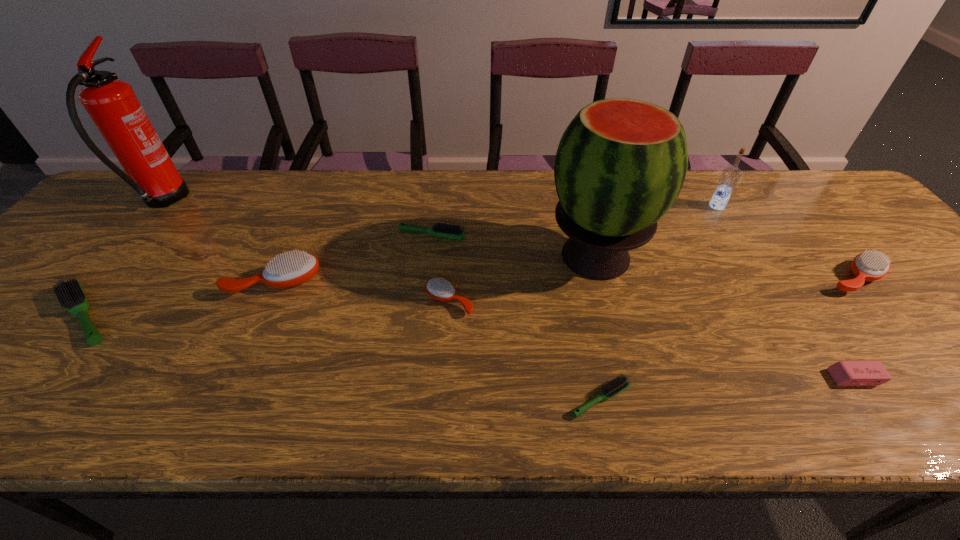
In order to click on hairbrush that can be found as the closest to the second smallest orange hairbrush in this screenshot , I will do `click(621, 383)`.

In order to click on the second closest orange hairbrush relative to the leftmost light hairbrush in this screenshot , I will do `click(440, 289)`.

Identify which orange hairbrush is the closest to the second orange hairbrush from right to left. Please provide its 2D coordinates. Your answer should be formatted as a tuple, i.e. [(x, y)], where the tuple contains the x and y coordinates of a point satisfying the conditions above.

[(290, 270)]

Where is `light hairbrush that is the closest to the blue vodka`? This screenshot has height=540, width=960. light hairbrush that is the closest to the blue vodka is located at coordinates (621, 383).

What are the coordinates of `light hairbrush that is the second closest to the green watermelon` in the screenshot? It's located at (621, 383).

The image size is (960, 540). I want to click on vacant area in the image that satisfies the following two spatial constraints: 1. at the nozzle of the red fire extinguisher; 2. on the left side of the vodka, so click(159, 206).

The height and width of the screenshot is (540, 960). Find the location of `vacant area in the image that satisfies the following two spatial constraints: 1. on the front side of the fifth hairbrush from left to right; 2. on the right side of the leftmost hairbrush`. vacant area in the image that satisfies the following two spatial constraints: 1. on the front side of the fifth hairbrush from left to right; 2. on the right side of the leftmost hairbrush is located at coordinates (17, 399).

Where is `free spot that satisfies the following two spatial constraints: 1. on the front side of the rightmost object; 2. on the right side of the second smallest light hairbrush`? The height and width of the screenshot is (540, 960). free spot that satisfies the following two spatial constraints: 1. on the front side of the rightmost object; 2. on the right side of the second smallest light hairbrush is located at coordinates (427, 278).

Find the location of a particular element. The height and width of the screenshot is (540, 960). free space that satisfies the following two spatial constraints: 1. at the nozzle of the red fire extinguisher; 2. on the back side of the second orange hairbrush from left to right is located at coordinates (80, 301).

You are a GUI agent. You are given a task and a screenshot of the screen. Output one action in this format:
    pyautogui.click(x=<x>, y=<y>)
    Task: Click on the free location that satisfies the following two spatial constraints: 1. at the nozzle of the red fire extinguisher; 2. on the right side of the biggest light hairbrush
    
    Given the screenshot: What is the action you would take?
    pyautogui.click(x=69, y=315)